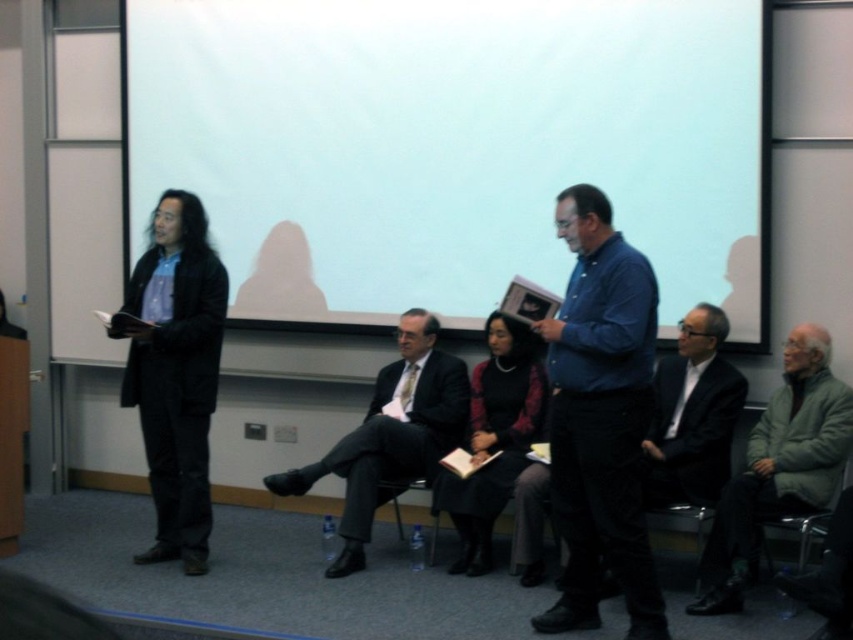
You are an attendee at a conference and need to present your slides. The projector is set up to display on the white matte projection screen at upper center. However, you notice a dark gray plastic chair at lower right blocking the screen. Can you move the chair to ensure the screen is visible?

The white matte projection screen at upper center is above the dark gray plastic chair at lower right, so moving the chair away from the screen will ensure visibility.

You are a photographer in this scene and want to take a picture of the blue denim shirt at center and the gray woolen sweater at right. Since you can only focus on one person at a time, which one should you focus on first to ensure the other is still in focus?

The blue denim shirt at center is located above the gray woolen sweater at right, so focusing on the blue denim shirt at center first would keep the gray woolen sweater at right in focus as it is lower in the frame.

You are an event planner setting up a presentation in the conference room described. You need to ensure that the white matte projection screen at upper center is visible to all attendees seated in the dark gray plastic chair at lower right. Given their positions, will the screen be tall enough to accommodate the seating arrangement?

The white matte projection screen at upper center has a greater height compared to dark gray plastic chair at lower right, so the screen should be tall enough to be visible to attendees seated in the dark gray plastic chair at lower right.